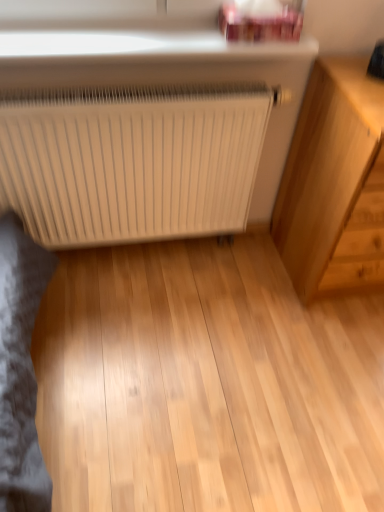
Describe the element at coordinates (334, 183) in the screenshot. The width and height of the screenshot is (384, 512). I see `light wood chest of drawers at right` at that location.

This screenshot has width=384, height=512. I want to click on light wood chest of drawers at right, so click(334, 183).

Measure the distance between white matte radiator at center and camera.

The depth of white matte radiator at center is 1.23 meters.

Image resolution: width=384 pixels, height=512 pixels. I want to click on white matte radiator at center, so click(131, 162).

The height and width of the screenshot is (512, 384). What do you see at coordinates (131, 162) in the screenshot?
I see `white matte radiator at center` at bounding box center [131, 162].

Find the location of a particular element. This screenshot has height=512, width=384. light wood chest of drawers at right is located at coordinates (334, 183).

Considering the relative positions of light wood chest of drawers at right and white matte radiator at center in the image provided, is light wood chest of drawers at right to the left or to the right of white matte radiator at center?

Clearly, light wood chest of drawers at right is on the right of white matte radiator at center in the image.

Relative to white matte radiator at center, is light wood chest of drawers at right in front or behind?

light wood chest of drawers at right is in front of white matte radiator at center.

Which is closer, (331, 143) or (69, 143)?

The point (331, 143) is closer.

From the image's perspective, is light wood chest of drawers at right located above white matte radiator at center?

Yes, from the image's perspective, light wood chest of drawers at right is above white matte radiator at center.

From a real-world perspective, is light wood chest of drawers at right physically located above or below white matte radiator at center?

Clearly, from a real-world perspective, light wood chest of drawers at right is above white matte radiator at center.

Looking at their sizes, would you say light wood chest of drawers at right is wider or thinner than white matte radiator at center?

Considering their sizes, light wood chest of drawers at right looks broader than white matte radiator at center.

In the scene shown: Can you confirm if light wood chest of drawers at right is taller than white matte radiator at center?

Correct, light wood chest of drawers at right is much taller as white matte radiator at center.

Is light wood chest of drawers at right bigger than white matte radiator at center?

Yes, light wood chest of drawers at right is bigger than white matte radiator at center.

Is white matte radiator at center completely or partially inside light wood chest of drawers at right?

No.

Is light wood chest of drawers at right next to white matte radiator at center?

No, light wood chest of drawers at right is not next to white matte radiator at center.

Is white matte radiator at center at the back of light wood chest of drawers at right?

That's not correct — light wood chest of drawers at right is not looking away from white matte radiator at center.

How many degrees apart are the facing directions of light wood chest of drawers at right and white matte radiator at center?

The angular difference between light wood chest of drawers at right and white matte radiator at center is 0.436 degrees.

This screenshot has width=384, height=512. Identify the location of radiator lying behind the light wood chest of drawers at right. [131, 162].

Can you confirm if white matte radiator at center is positioned to the left of light wood chest of drawers at right?

Yes.

Is white matte radiator at center closer to camera compared to light wood chest of drawers at right?

No, it is not.

From the picture: Which is nearer, (192, 192) or (332, 227)?

Point (192, 192).

From the image's perspective, relative to light wood chest of drawers at right, is white matte radiator at center above or below?

Based on their image positions, white matte radiator at center is located beneath light wood chest of drawers at right.

From a real-world perspective, does white matte radiator at center stand above light wood chest of drawers at right?

Actually, white matte radiator at center is physically below light wood chest of drawers at right in the real world.

In terms of width, does white matte radiator at center look wider or thinner when compared to light wood chest of drawers at right?

Considering their sizes, white matte radiator at center looks slimmer than light wood chest of drawers at right.

Who is shorter, white matte radiator at center or light wood chest of drawers at right?

white matte radiator at center is shorter.

In the scene shown: Can you confirm if white matte radiator at center is smaller than light wood chest of drawers at right?

Yes, white matte radiator at center is smaller than light wood chest of drawers at right.

Would you say white matte radiator at center is outside light wood chest of drawers at right?

Absolutely, white matte radiator at center is external to light wood chest of drawers at right.

Is the surface of white matte radiator at center in direct contact with light wood chest of drawers at right?

white matte radiator at center and light wood chest of drawers at right are clearly separated.

Is white matte radiator at center positioned with its back to light wood chest of drawers at right?

That's not correct — white matte radiator at center is not looking away from light wood chest of drawers at right.

I want to click on the chest of drawers that is above the white matte radiator at center (from a real-world perspective), so 334,183.

Find the location of a particular element. radiator behind the light wood chest of drawers at right is located at coordinates (131, 162).

You are a GUI agent. You are given a task and a screenshot of the screen. Output one action in this format:
    pyautogui.click(x=<x>, y=<y>)
    Task: Click on the radiator below the light wood chest of drawers at right (from the image's perspective)
    
    Given the screenshot: What is the action you would take?
    coord(131,162)